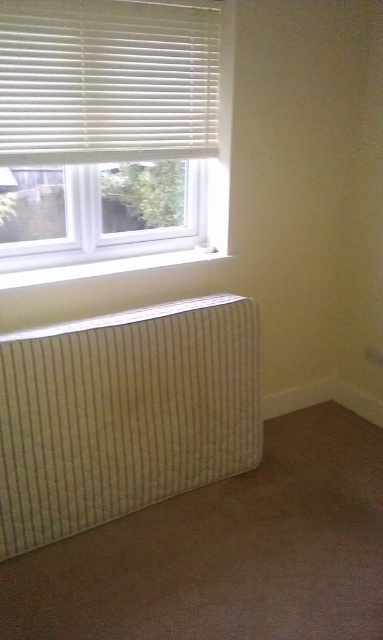
You are standing in the corner of the room where the beige corduroy radiator at lower left and the white plastic blinds at upper left are located. You want to place a small potted plant on the windowsill. Which object should you place it closer to if you want the plant to receive more sunlight?

You should place the plant closer to the white plastic blinds at upper left because the beige corduroy radiator at lower left is located below them, meaning the blinds are higher up near the window where more sunlight comes through.

You are a maintenance worker needing to replace a part that requires access to both the beige corduroy radiator at lower left and the white plastic blinds at upper left. The tool you need is 36 inches long. Can you fit the tool between them without moving either object?

The beige corduroy radiator at lower left and the white plastic blinds at upper left are 36.69 inches apart, so the 36 inch tool can fit between them since it is shorter than the distance between the two objects.

You are standing in the room and want to place a tall plant next to the beige corduroy radiator at lower left. Considering the height of the radiator and the position of the white plastic blinds at upper left, will the plant be visible through the window?

The beige corduroy radiator at lower left is much taller than the white plastic blinds at upper left. Since the radiator is taller, placing the tall plant next to it may block the view through the window, as the plant could extend beyond the blinds and into the window area.